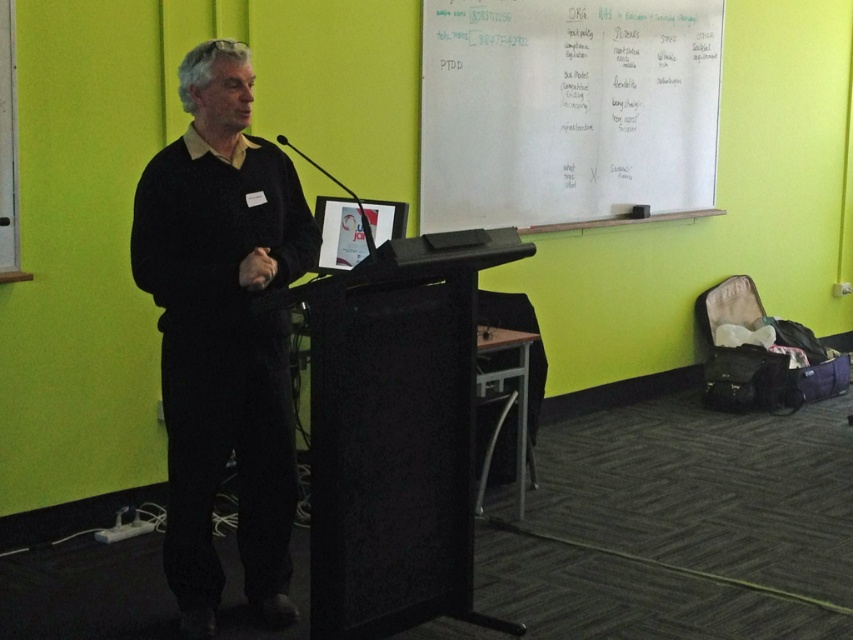
Question: Which of the following is the farthest from the observer?

Choices:
 (A) black matte podium at center
 (B) whiteboard at upper center
 (C) black matte sweater at left

Answer: (B)

Question: Which object is the farthest from the black matte podium at center?

Choices:
 (A) black matte sweater at left
 (B) whiteboard at upper center

Answer: (B)

Question: Is black matte sweater at left to the left of black matte podium at center from the viewer's perspective?

Choices:
 (A) yes
 (B) no

Answer: (A)

Question: Is black matte sweater at left smaller than whiteboard at upper center?

Choices:
 (A) yes
 (B) no

Answer: (A)

Question: Which of the following is the closest to the observer?

Choices:
 (A) (328, 488)
 (B) (453, 218)
 (C) (262, 513)

Answer: (A)

Question: Does black matte sweater at left come in front of whiteboard at upper center?

Choices:
 (A) yes
 (B) no

Answer: (A)